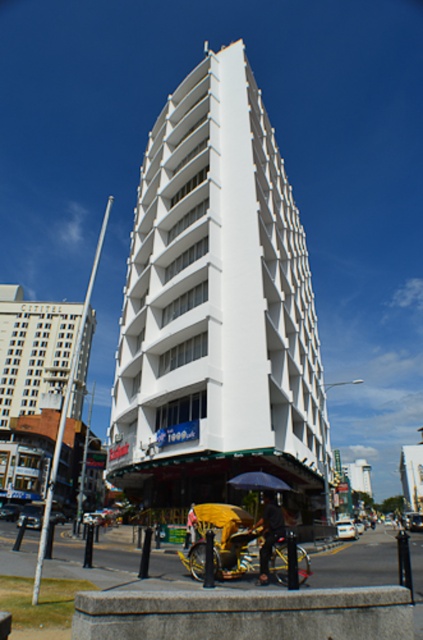
You are standing at point (217, 314) in the image. What object is directly at your current location?

The white smooth building at center is directly at point (217, 314).

You are standing at the base of the multi story building and want to reach a point that is exactly 112.94 feet away from the camera. Is the point at point (120, 432) within the building or outside of it?

The point at point (120, 432) is 112.94 feet away from the camera, so it is outside of the building since the distance matches the required distance from the camera.

You are standing on the sidewalk in front of the white smooth building at center and the yellow fabric at center. Which object is closer to you?

The yellow fabric at center is closer to you because the white smooth building at center is further away.